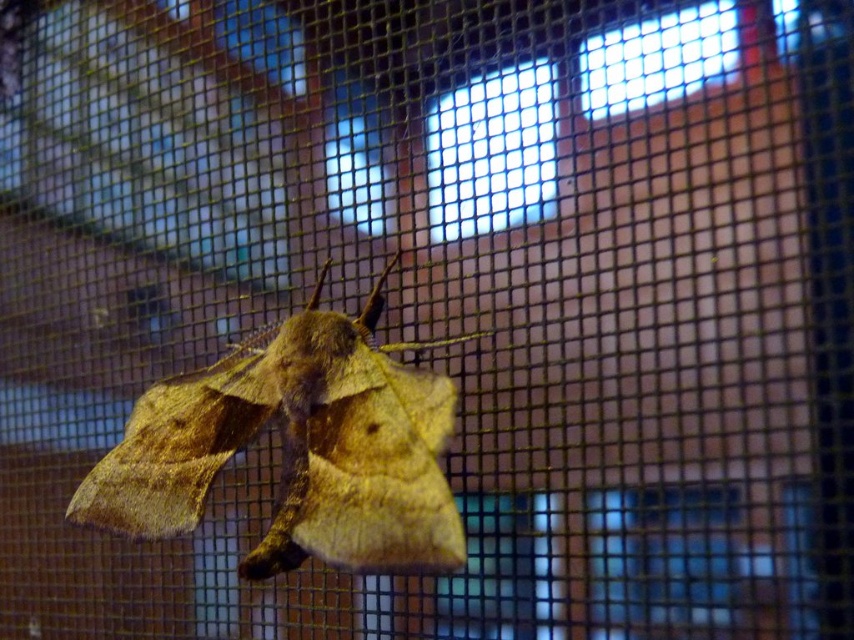
Can you confirm if fuzzy brown moth at center is positioned below transparent glass window at upper center?

Yes, fuzzy brown moth at center is below transparent glass window at upper center.

Find the location of `fuzzy brown moth at center`. fuzzy brown moth at center is located at coordinates (297, 449).

Who is more distant from viewer, (178, 477) or (547, 136)?

Point (178, 477)

What are the coordinates of `fuzzy brown moth at center` in the screenshot? It's located at (297, 449).